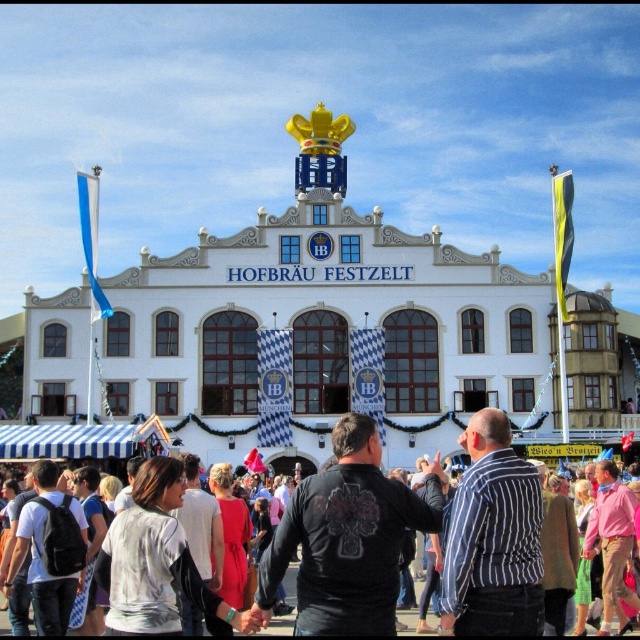
You are a photographer standing in front of the HOFBRAEU FESTZELT building and notice two people wearing a black leather jacket at center and a white cotton shirt at center. Which clothing item is shorter in height?

The black leather jacket at center is shorter than the white cotton shirt at center.

You are a photographer standing in front of the HOFBRAEU FESTZELT. You notice two people wearing a black leather jacket at center and a white cotton shirt at center. Which clothing item is smaller in size?

The black leather jacket at center is smaller than the white cotton shirt at center.